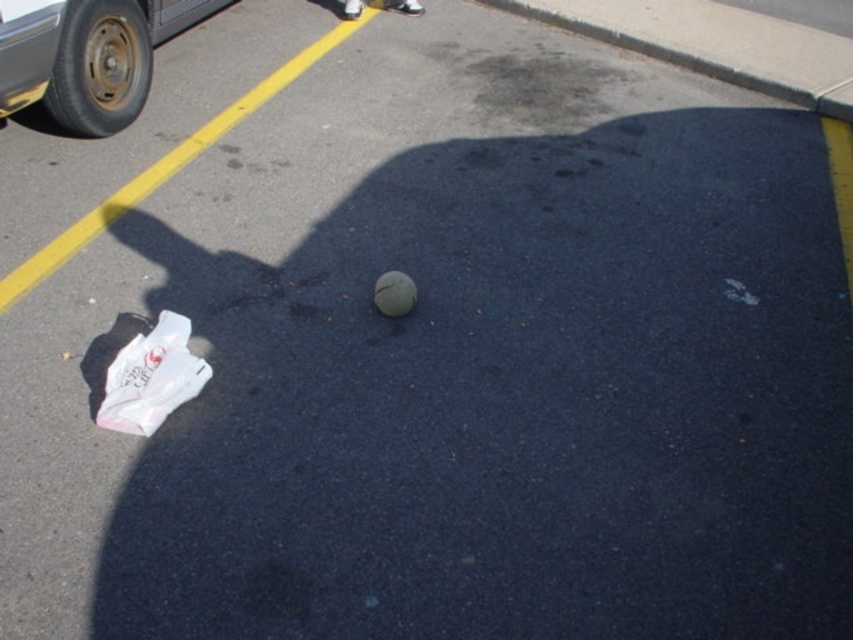
You are standing at the white plastic bag at lower left and want to throw a tennis ball to the yellow painted line diagonally across the frame. Can you reach the line from your position without moving?

The distance between the white plastic bag at lower left and the yellow painted line diagonally across the frame is 8.92 feet, so yes, you can reach the line by throwing the tennis ball that distance.

You are a robot tasked with picking up the white plastic bag at lower left and the white matte ball at center. The robot has a maximum reach of 30 inches. Can you grab both items without moving your position?

The distance between the white plastic bag at lower left and the white matte ball at center is 32.42 inches, which exceeds the robot s 30 inch reach. Therefore, the robot cannot grab both items simultaneously without moving its position.

You are a delivery person who needs to place a small package in the parking lot. The package is the same size as the white matte ball at center. Where should you place it to ensure it doesn not get crushed by vehicles, considering the white plastic bag at lower left is larger and might block the ball?

Place the package where the white matte ball at center is located because the white plastic bag at lower left is bigger and could potentially block or crush the smaller ball if placed near it.